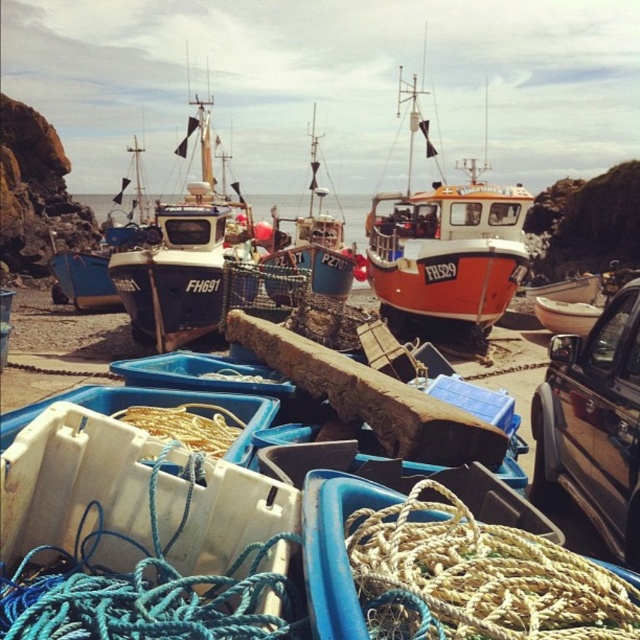
You are a fisherman who needs to secure a small net. You have two ropes available, the natural beige rope at center and the blue rope at lower center. Which rope is more suitable for securing the net based on their sizes?

The blue rope at lower center is more suitable for securing the net because it has a larger size compared to the natural beige rope at center.

You are a fisherman checking the ropes on your boat. You have two ropes available, the natural beige rope at center and the blue rope at lower center. Which rope is taller?

The natural beige rope at center is taller than the blue rope at lower center.

You need to transport a large crate that requires a vehicle wider than the matte black boat at left. Can the black glossy truck at right accommodate this crate?

The black glossy truck at right is narrower than the matte black boat at left, so it cannot accommodate the crate which requires a vehicle wider than the matte black boat at left.